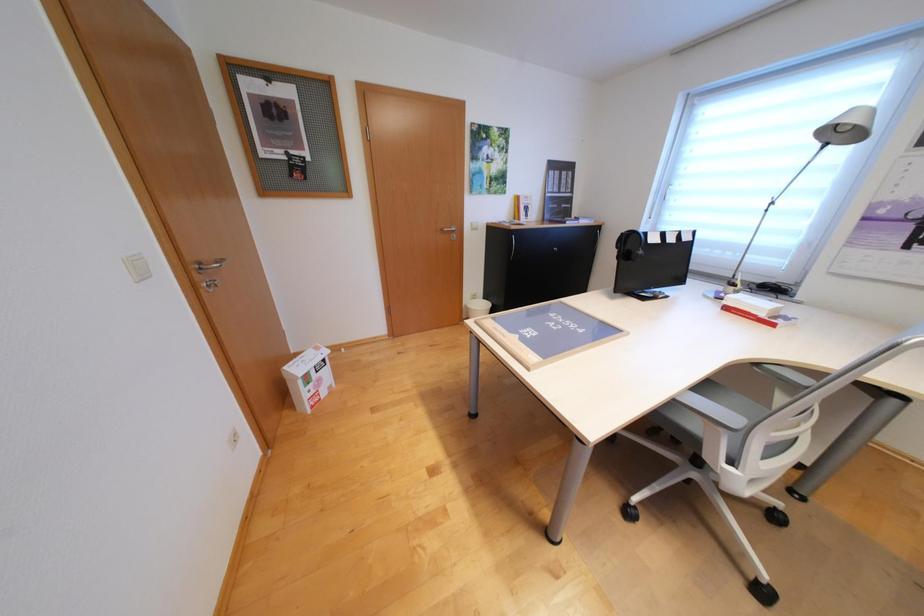
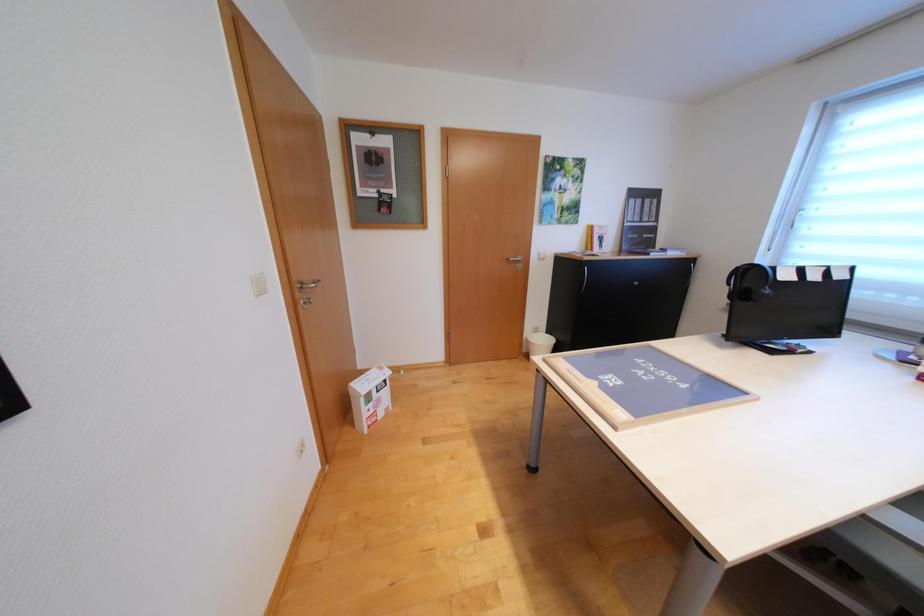
In a continuous first-person perspective shot, in which direction is the camera moving?

The cameraman moved toward left, forward.